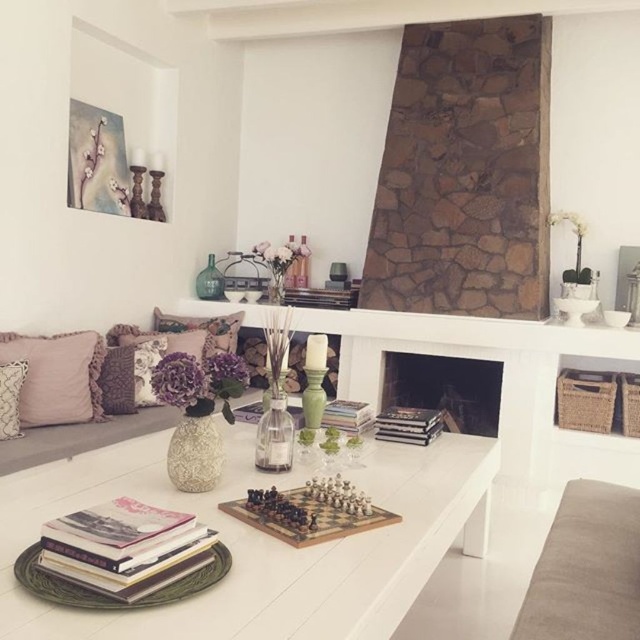
Question: Can you confirm if white glossy coffee table at center is smaller than pale pink fabric cushion at left?

Choices:
 (A) yes
 (B) no

Answer: (B)

Question: Based on their relative distances, which object is farther from the wooden chess set at center?

Choices:
 (A) pale pink fabric cushion at left
 (B) velvet floral pillow at center
 (C) white glossy coffee table at center

Answer: (B)

Question: Which point is farther from the camera taking this photo?

Choices:
 (A) (330, 592)
 (B) (273, 529)
 (C) (396, 368)

Answer: (C)

Question: Does pale pink fabric cushion at left lie behind satin pink pillow at left?

Choices:
 (A) yes
 (B) no

Answer: (A)

Question: Among these objects, which one is nearest to the camera?

Choices:
 (A) wooden chess set at center
 (B) white glossy coffee table at center
 (C) velvet floral pillow at center

Answer: (B)

Question: Is pale pink fabric cushion at left below satin pink pillow at left?

Choices:
 (A) yes
 (B) no

Answer: (B)